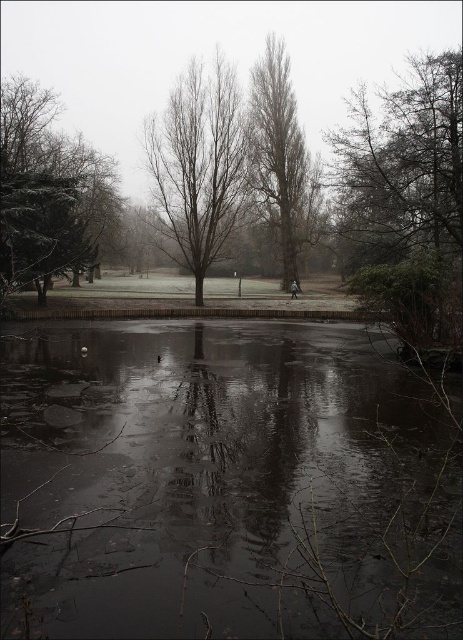
The width and height of the screenshot is (463, 640). Describe the element at coordinates (406, 182) in the screenshot. I see `smooth brown tree at right` at that location.

Can you confirm if smooth brown tree at right is positioned to the left of bare branches tree at center?

Incorrect, smooth brown tree at right is not on the left side of bare branches tree at center.

I want to click on smooth brown tree at right, so click(406, 182).

Between point (242, 138) and point (294, 289), which one is positioned in front?

Point (242, 138) is in front.

Who is positioned more to the left, bare branches tree at center or dark gray fabric jacket at center?

From the viewer's perspective, bare branches tree at center appears more on the left side.

Does point (166, 208) come in front of point (295, 289)?

Yes, point (166, 208) is closer to viewer.

Locate an element on the screen. bare branches tree at center is located at coordinates (198, 166).

Is snow-covered evergreen tree at left below dark gray fabric jacket at center?

No, snow-covered evergreen tree at left is not below dark gray fabric jacket at center.

Based on the photo, does snow-covered evergreen tree at left have a smaller size compared to dark gray fabric jacket at center?

No, snow-covered evergreen tree at left is not smaller than dark gray fabric jacket at center.

What are the coordinates of `snow-covered evergreen tree at left` in the screenshot? It's located at (48, 193).

In order to click on snow-covered evergreen tree at left in this screenshot , I will do `click(48, 193)`.